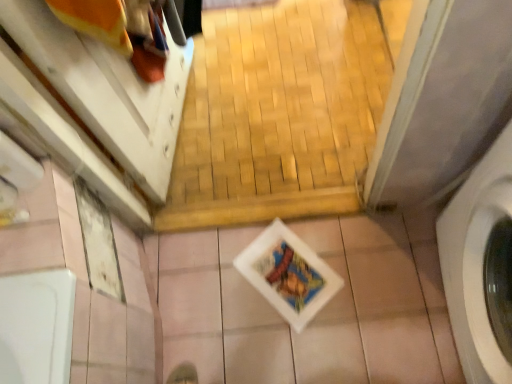
The width and height of the screenshot is (512, 384). What do you see at coordinates (318, 313) in the screenshot?
I see `white glossy square at center` at bounding box center [318, 313].

Where is `white glossy square at center`? The height and width of the screenshot is (384, 512). white glossy square at center is located at coordinates (318, 313).

At what (x,y) coordinates should I click in order to perform the action: click on white glossy square at center. Please return your answer as a coordinate pair (x, y). This screenshot has height=384, width=512. Looking at the image, I should click on (318, 313).